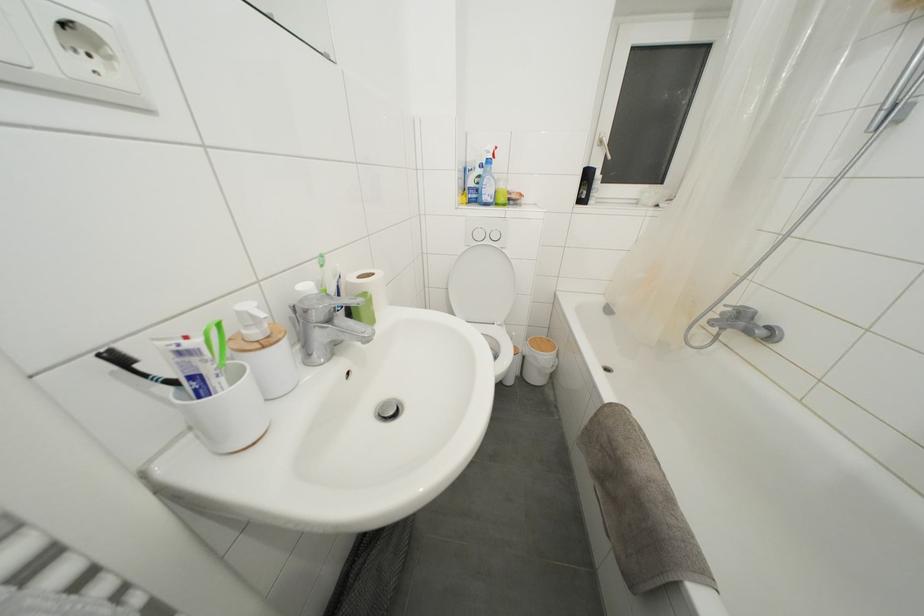
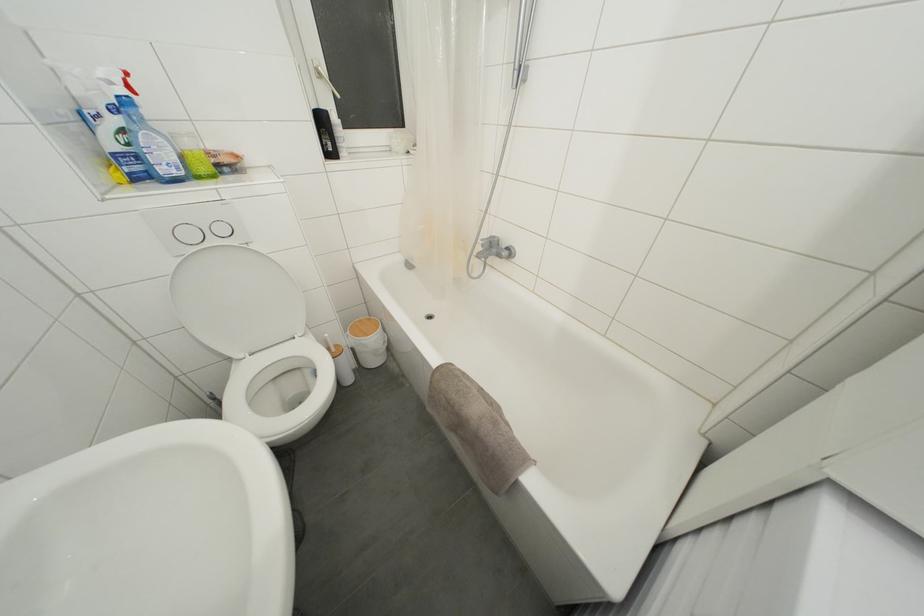
In the second image, find the point that corresponds to (505,191) in the first image.

(193, 148)